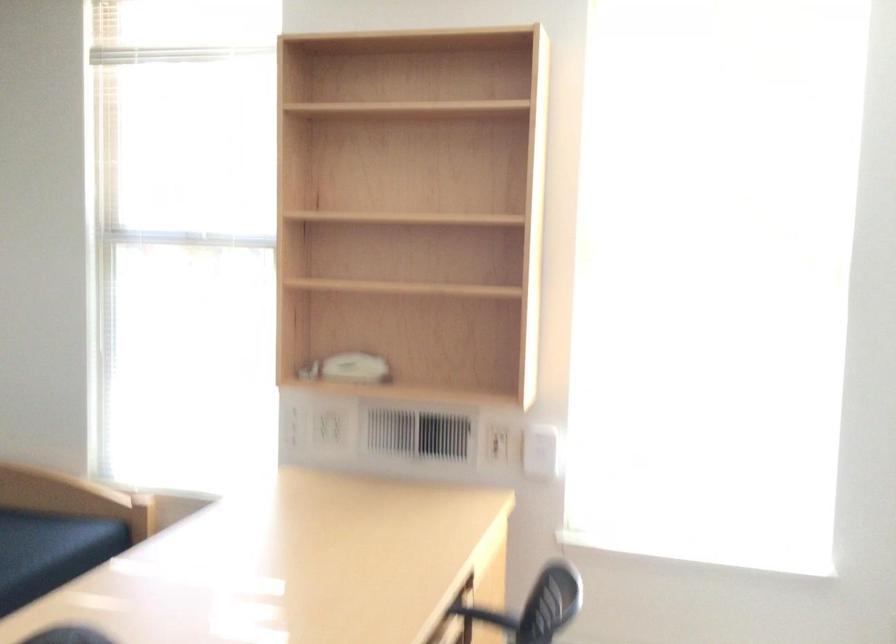
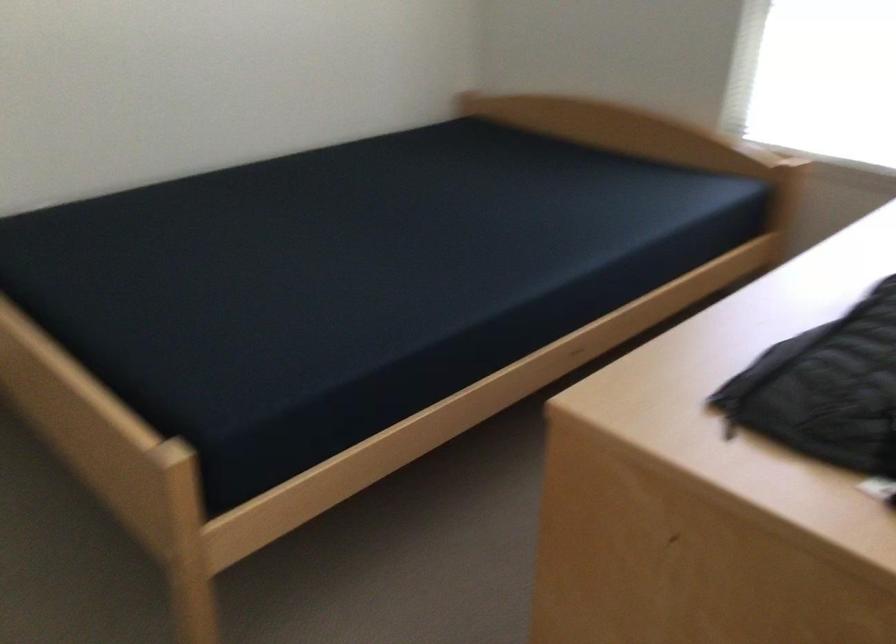
The first image is from the beginning of the video and the second image is from the end. How did the camera likely rotate when shooting the video?

The camera's rotation is toward left-down.